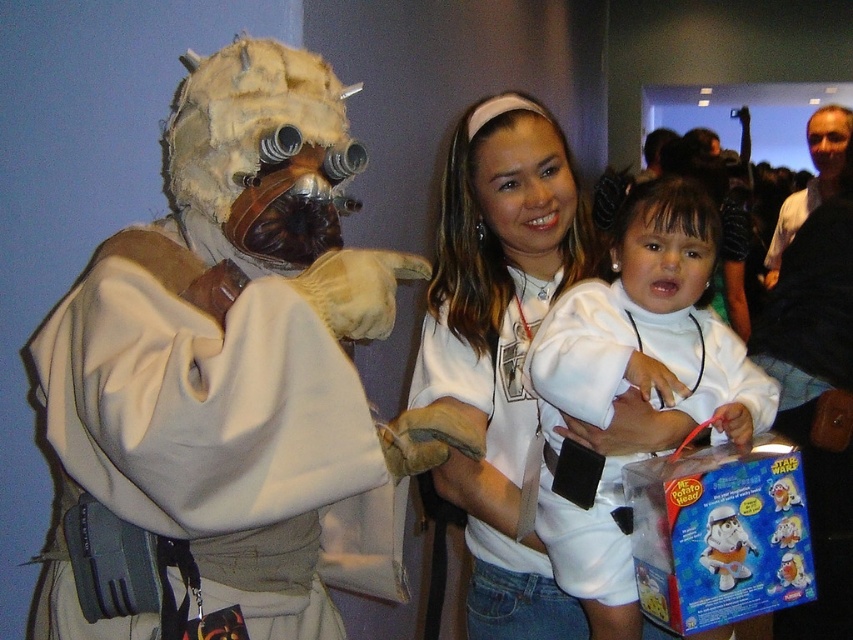
Image resolution: width=853 pixels, height=640 pixels. Describe the element at coordinates (650, 323) in the screenshot. I see `white matte/soft fabric child at center` at that location.

Is white matte/soft fabric child at center closer to camera compared to plush white toy at lower right?

Yes.

Where is `white matte/soft fabric child at center`? This screenshot has width=853, height=640. white matte/soft fabric child at center is located at coordinates (650, 323).

Which is in front, point (479, 513) or point (791, 572)?

Positioned in front is point (791, 572).

Looking at this image, can you confirm if white matte shirt at center is positioned below plush white toy at lower right?

Actually, white matte shirt at center is above plush white toy at lower right.

The height and width of the screenshot is (640, 853). I want to click on white matte shirt at center, so click(x=496, y=458).

Where is `white matte shirt at center`? The height and width of the screenshot is (640, 853). white matte shirt at center is located at coordinates (496, 458).

Does point (196, 259) lie behind point (665, 374)?

No.

Is fuzzy beige costume at left wider than white matte/soft fabric child at center?

Correct, the width of fuzzy beige costume at left exceeds that of white matte/soft fabric child at center.

Which is in front, point (51, 435) or point (630, 548)?

Positioned in front is point (51, 435).

At what (x,y) coordinates should I click in order to perform the action: click on fuzzy beige costume at left. Please return your answer as a coordinate pair (x, y). This screenshot has width=853, height=640. Looking at the image, I should click on (224, 374).